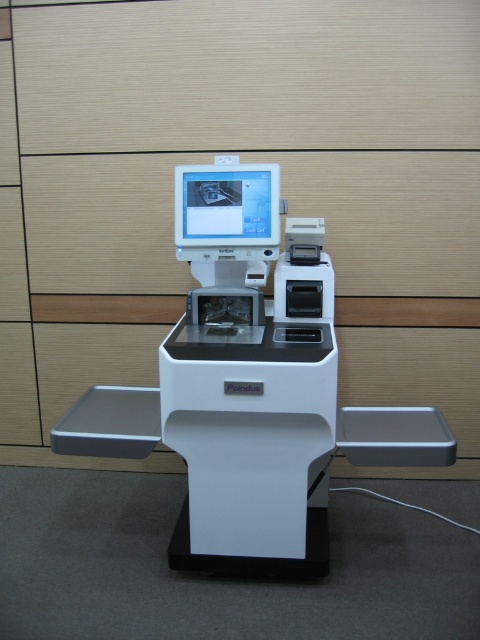
Who is shorter, white plastic machine at center or matte white monitor at center?

Standing shorter between the two is matte white monitor at center.

Between white plastic machine at center and matte white monitor at center, which one has more height?

With more height is white plastic machine at center.

Which is behind, point (441, 428) or point (259, 205)?

The point (259, 205) is behind.

Image resolution: width=480 pixels, height=640 pixels. Find the location of `white plastic machine at center`. white plastic machine at center is located at coordinates (250, 387).